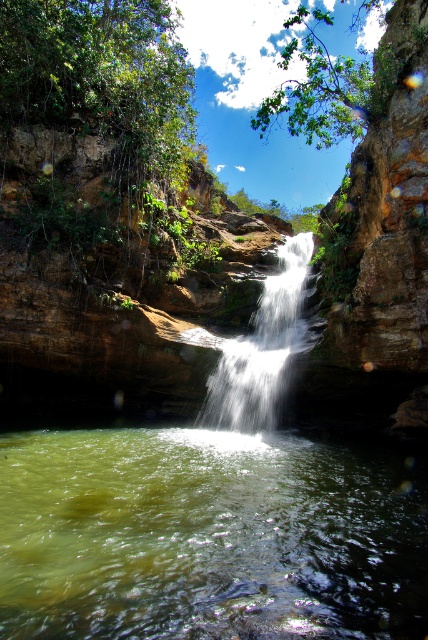
You are standing at the base of the waterfall and want to reach the highest point you can see. Which point, point (x=6, y=554) or point (x=199, y=413), is closer to you and thus easier to reach?

Point (x=6, y=554) is closer to the viewer than point (x=199, y=413), so it is easier to reach.

You are a photographer planning to capture the waterfall and the surrounding area. You want to ensure that both the green translucent water at center and the white silky waterfall at center are clearly visible in your shot. Given their sizes, which one should you focus on to ensure it takes up more of the frame?

The white silky waterfall at center occupies more space than the green translucent water at center, so focusing on the white silky waterfall at center will ensure it takes up more of the frame.